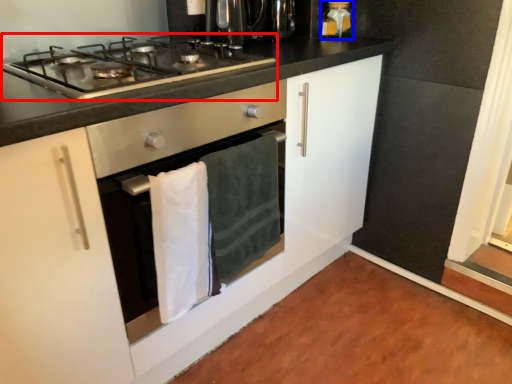
Question: Which object appears closest to the camera in this image, gas stove (highlighted by a red box) or kitchen appliance (highlighted by a blue box)?

Choices:
 (A) gas stove
 (B) kitchen appliance

Answer: (A)